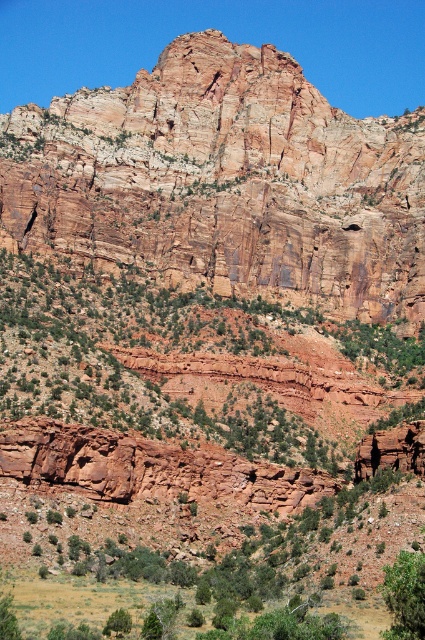
Question: Is rustic rock formation at center to the left of green leafy bush at lower right from the viewer's perspective?

Choices:
 (A) yes
 (B) no

Answer: (A)

Question: Among these objects, which one is farthest from the camera?

Choices:
 (A) green leafy bush at lower right
 (B) rustic rock formation at center

Answer: (B)

Question: Can you confirm if rustic rock formation at center is positioned above green leafy bush at lower right?

Choices:
 (A) yes
 (B) no

Answer: (A)

Question: Does rustic rock formation at center appear under green leafy bush at lower right?

Choices:
 (A) yes
 (B) no

Answer: (B)